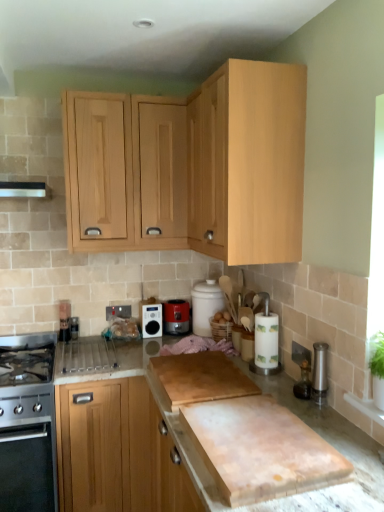
Question: Is matte black radio at center, which is the second kitchen appliance in top-to-bottom order, looking in the opposite direction of light wood cabinet at lower left, the 4th cabinetry viewed from the top?

Choices:
 (A) no
 (B) yes

Answer: (A)

Question: Is matte black radio at center, which is the second kitchen appliance in top-to-bottom order, next to light wood cabinet at lower left, the 4th cabinetry viewed from the top?

Choices:
 (A) no
 (B) yes

Answer: (A)

Question: Considering the relative positions of matte black radio at center, the second kitchen appliance in the right-to-left sequence, and light wood cabinet at lower left, positioned as the 1th cabinetry in bottom-to-top order, in the image provided, is matte black radio at center, the second kitchen appliance in the right-to-left sequence, to the left of light wood cabinet at lower left, positioned as the 1th cabinetry in bottom-to-top order, from the viewer's perspective?

Choices:
 (A) yes
 (B) no

Answer: (B)

Question: Is matte black radio at center, which is the second kitchen appliance in top-to-bottom order, in front of light wood cabinet at lower left, positioned as the 1th cabinetry in bottom-to-top order?

Choices:
 (A) yes
 (B) no

Answer: (B)

Question: Does matte black radio at center, which is counted as the 2th kitchen appliance, starting from the left, have a larger size compared to light wood cabinet at lower left, the 4th cabinetry viewed from the top?

Choices:
 (A) yes
 (B) no

Answer: (B)

Question: Considering the relative sizes of matte black radio at center, the second kitchen appliance in the right-to-left sequence, and light wood cabinet at lower left, the 4th cabinetry viewed from the top, in the image provided, is matte black radio at center, the second kitchen appliance in the right-to-left sequence, shorter than light wood cabinet at lower left, the 4th cabinetry viewed from the top,?

Choices:
 (A) yes
 (B) no

Answer: (A)

Question: Does metallic silver toaster at lower left have a lesser height compared to matte red toaster at center, arranged as the 1th kitchen appliance when viewed from the right?

Choices:
 (A) yes
 (B) no

Answer: (A)

Question: Is matte red toaster at center, marked as the 3th kitchen appliance in a bottom-to-top arrangement, located within metallic silver toaster at lower left?

Choices:
 (A) no
 (B) yes

Answer: (A)

Question: Does metallic silver toaster at lower left have a greater width compared to matte red toaster at center, which ranks as the third kitchen appliance in left-to-right order?

Choices:
 (A) yes
 (B) no

Answer: (B)

Question: From the image's perspective, is metallic silver toaster at lower left located above matte red toaster at center, arranged as the 1th kitchen appliance when viewed from the right?

Choices:
 (A) no
 (B) yes

Answer: (A)

Question: Can you confirm if metallic silver toaster at lower left is smaller than matte red toaster at center, arranged as the 1th kitchen appliance when viewed from the right?

Choices:
 (A) no
 (B) yes

Answer: (B)

Question: Is metallic silver toaster at lower left outside matte red toaster at center, marked as the 3th kitchen appliance in a bottom-to-top arrangement?

Choices:
 (A) no
 (B) yes

Answer: (B)

Question: Is light wood cabinet at upper center, the fourth cabinetry in the bottom-to-top sequence, positioned in front of metallic silver toaster at lower left?

Choices:
 (A) yes
 (B) no

Answer: (A)